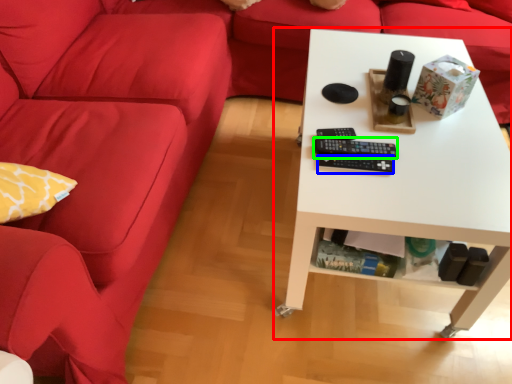
Question: Which object is the closest to the table (highlighted by a red box)? Choose among these: control (highlighted by a blue box) or control (highlighted by a green box).

Choices:
 (A) control
 (B) control

Answer: (B)